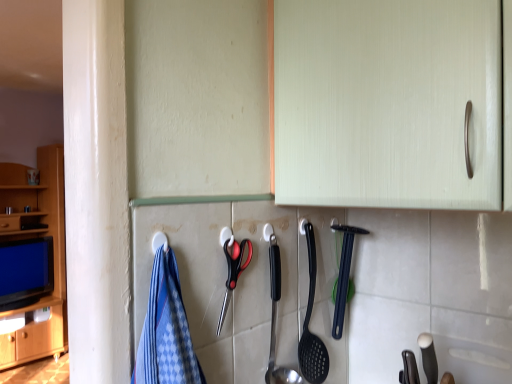
Question: Is satin silver spoon at center, positioned as the 2th silverware in back-to-front order, at the left side of black plastic scissors at center?

Choices:
 (A) yes
 (B) no

Answer: (B)

Question: Is satin silver spoon at center, the first silverware from the left, positioned with its back to black plastic scissors at center?

Choices:
 (A) yes
 (B) no

Answer: (B)

Question: Considering the relative positions of satin silver spoon at center, arranged as the first silverware when viewed from the front, and black plastic scissors at center in the image provided, is satin silver spoon at center, arranged as the first silverware when viewed from the front, behind black plastic scissors at center?

Choices:
 (A) no
 (B) yes

Answer: (B)

Question: Can you confirm if satin silver spoon at center, arranged as the first silverware when viewed from the front, is smaller than black plastic scissors at center?

Choices:
 (A) no
 (B) yes

Answer: (A)

Question: From a real-world perspective, is satin silver spoon at center, positioned as the 2th silverware in back-to-front order, physically above black plastic scissors at center?

Choices:
 (A) yes
 (B) no

Answer: (B)

Question: Visually, is black plastic spoon at center, the 1th silverware when ordered from back to front, positioned to the left or to the right of black plastic scissors at center?

Choices:
 (A) right
 (B) left

Answer: (A)

Question: Is black plastic spoon at center, positioned as the second silverware in front-to-back order, wider or thinner than black plastic scissors at center?

Choices:
 (A) thin
 (B) wide

Answer: (B)

Question: Is black plastic spoon at center, acting as the second silverware starting from the left, bigger or smaller than black plastic scissors at center?

Choices:
 (A) small
 (B) big

Answer: (B)

Question: From a real-world perspective, is black plastic spoon at center, acting as the second silverware starting from the left, above or below black plastic scissors at center?

Choices:
 (A) above
 (B) below

Answer: (B)

Question: Is black plastic scissors at center wider or thinner than black plastic spoon at center, acting as the second silverware starting from the left?

Choices:
 (A) thin
 (B) wide

Answer: (A)

Question: From their relative heights in the image, would you say black plastic scissors at center is taller or shorter than black plastic spoon at center, positioned as the second silverware in front-to-back order?

Choices:
 (A) short
 (B) tall

Answer: (A)

Question: Is point pos(230,274) closer or farther from the camera than point pos(340,269)?

Choices:
 (A) farther
 (B) closer

Answer: (B)

Question: Based on their positions, is black plastic scissors at center located to the left or right of black plastic spoon at center, acting as the second silverware starting from the left?

Choices:
 (A) left
 (B) right

Answer: (A)

Question: From the image's perspective, is satin silver spoon at center, placed as the second silverware when sorted from right to left, above or below black plastic scissors at center?

Choices:
 (A) above
 (B) below

Answer: (B)

Question: From their relative heights in the image, would you say satin silver spoon at center, placed as the second silverware when sorted from right to left, is taller or shorter than black plastic scissors at center?

Choices:
 (A) short
 (B) tall

Answer: (B)